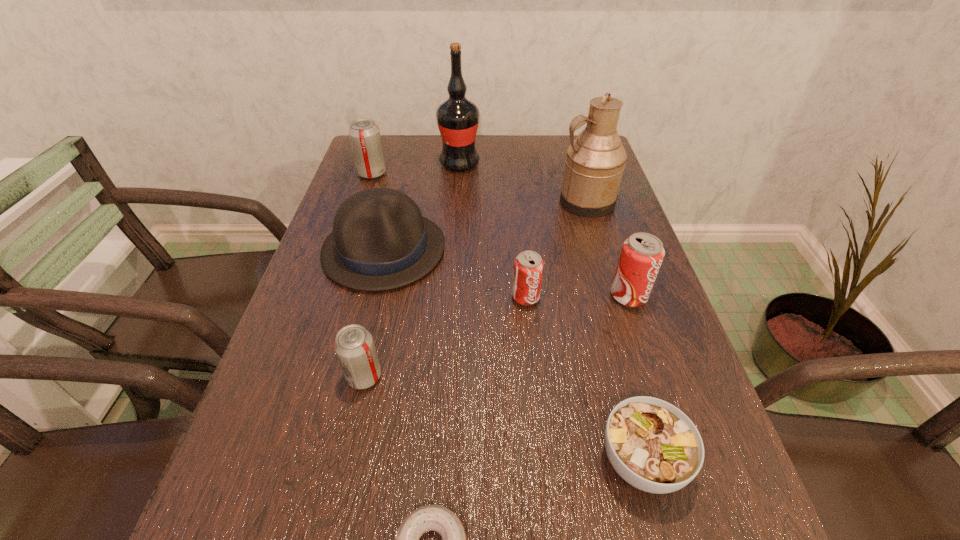
In the image, there is a desktop. Where is `vacant space at the right edge`? The height and width of the screenshot is (540, 960). vacant space at the right edge is located at coordinates (578, 235).

Identify the location of vacant space that's between the rightmost soda can and the fourth object from right to left. This screenshot has width=960, height=540. (577, 296).

Locate an element on the screen. The image size is (960, 540). vacant space that's between the bigger pink soda can and the red wine bottle is located at coordinates (544, 230).

Locate an element on the screen. This screenshot has height=540, width=960. vacant point located between the pitcher and the bowler hat is located at coordinates (485, 226).

Identify the location of unoccupied position between the eighth tallest object and the red wine bottle. The width and height of the screenshot is (960, 540). (551, 313).

This screenshot has height=540, width=960. I want to click on the closest object to the right gray soda can, so click(x=380, y=241).

Point out which object is positioned as the fourth nearest to the pitcher. Please provide its 2D coordinates. Your answer should be formatted as a tuple, i.e. [(x, y)], where the tuple contains the x and y coordinates of a point satisfying the conditions above.

[(380, 241)]

The width and height of the screenshot is (960, 540). In order to click on the second closest soda can to the second nearest object in this screenshot , I will do `click(528, 265)`.

Find the location of a particular element. soda can identified as the fourth closest to the shortest object is located at coordinates (364, 134).

This screenshot has height=540, width=960. Find the location of `vacant position in the image that satisfies the following two spatial constraints: 1. on the front-facing side of the white soup bowl; 2. on the left side of the bowler hat`. vacant position in the image that satisfies the following two spatial constraints: 1. on the front-facing side of the white soup bowl; 2. on the left side of the bowler hat is located at coordinates (333, 461).